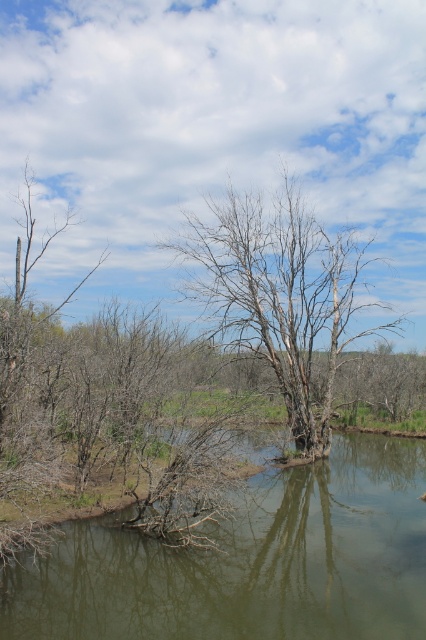
Question: Which point is closer to the camera?

Choices:
 (A) green murky water at center
 (B) bare wood tree at center

Answer: (A)

Question: Is green murky water at center wider than bare wood tree at center?

Choices:
 (A) yes
 (B) no

Answer: (B)

Question: Among these points, which one is nearest to the camera?

Choices:
 (A) (351, 624)
 (B) (347, 266)

Answer: (A)

Question: Is green murky water at center smaller than bare wood tree at center?

Choices:
 (A) yes
 (B) no

Answer: (A)

Question: Is green murky water at center closer to the viewer compared to bare wood tree at center?

Choices:
 (A) yes
 (B) no

Answer: (A)